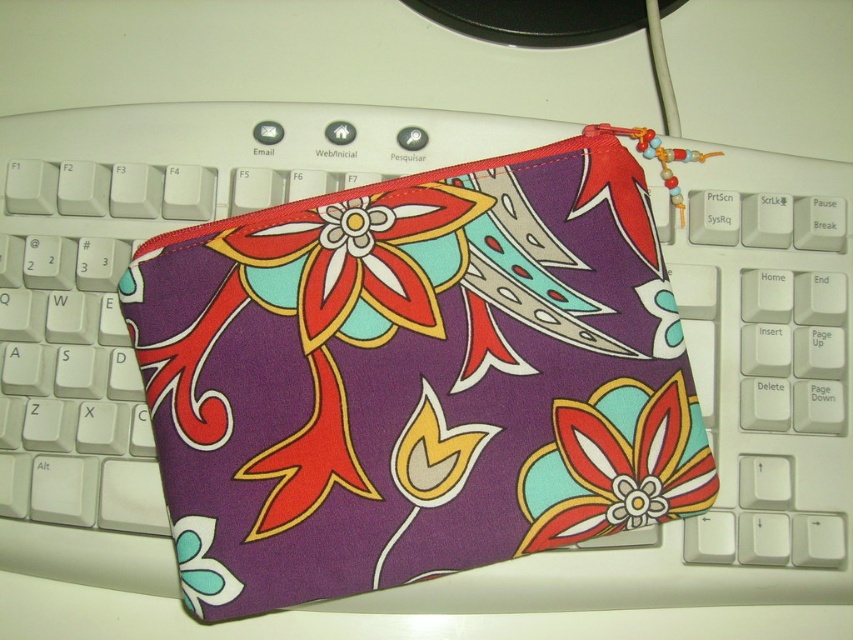
Consider the image. You are setting up a workspace and want to place a decorative item between the purple fabric pouch at center and the matte fabric flower at center on your keyboard. What is the minimum width this item should have to fit between them?

The minimum width should be at least 13.04 centimeters to fit between the purple fabric pouch at center and the matte fabric flower at center.

You are designing a pattern for a new fabric and want to ensure the floral fabric flower at center and the matte fabric flower at center are balanced. Based on their sizes, which flower should be placed closer to the edge of the design?

The floral fabric flower at center should be placed closer to the edge because its width surpasses that of the matte fabric flower at center, creating balance by offsetting the larger size.

You are setting up a workspace and want to place a decorative item on your keyboard. You have two options from the image, the floral fabric flower at center and the matte fabric flower at center. Which one is already positioned higher up on the keyboard?

The floral fabric flower at center is above the matte fabric flower at center, so it is already positioned higher up on the keyboard.